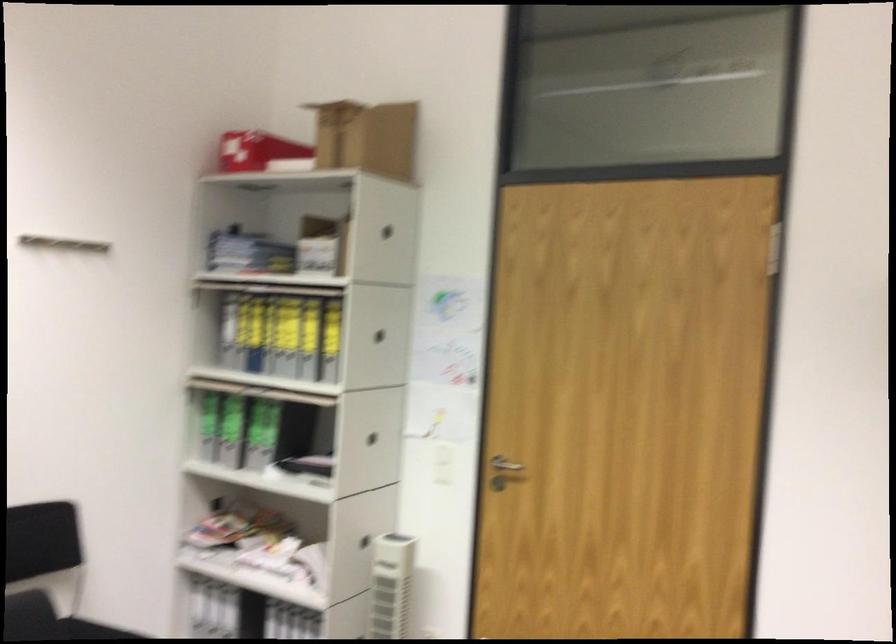
This screenshot has width=896, height=644. What are the coordinates of `silver door handle` in the screenshot? It's located at (504, 464).